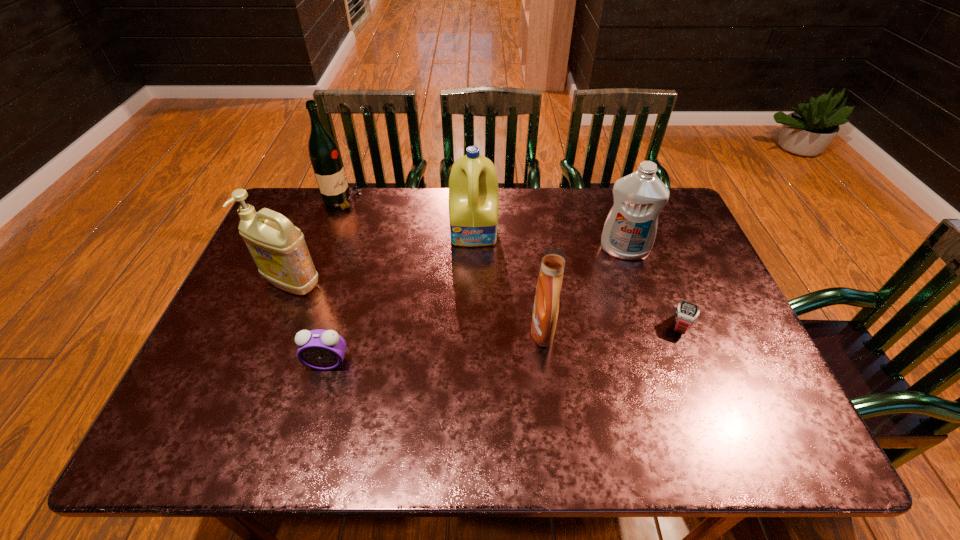
At what (x,y) coordinates should I click in order to perform the action: click on vacant space at the far left corner of the desktop. Please return your answer as a coordinate pair (x, y). Looking at the image, I should click on (309, 209).

In the image, there is a desktop. Where is `vacant region at the far right corner`? vacant region at the far right corner is located at coordinates (676, 217).

This screenshot has height=540, width=960. Find the location of `empty space between the nearest detergent and the sixth tallest object`. empty space between the nearest detergent and the sixth tallest object is located at coordinates (435, 347).

At what (x,y) coordinates should I click in order to perform the action: click on vacant space that's between the third object from right to left and the farthest object. Please return your answer as a coordinate pair (x, y). Looking at the image, I should click on (443, 266).

Locate an element on the screen. vacant area that lies between the shortest object and the alarm clock is located at coordinates (504, 344).

The image size is (960, 540). In order to click on vacant area between the third detergent from right to left and the rightmost detergent in this screenshot , I will do `click(549, 241)`.

Locate an element on the screen. vacant region between the fourth object from right to left and the nearest object is located at coordinates (401, 298).

You are a GUI agent. You are given a task and a screenshot of the screen. Output one action in this format:
    pyautogui.click(x=<x>, y=<y>)
    Task: Click on the free space between the wine bottle and the nearest object
    
    Given the screenshot: What is the action you would take?
    pyautogui.click(x=335, y=282)

Locate an element on the screen. This screenshot has width=960, height=540. free space between the nearest object and the second nearest detergent is located at coordinates (310, 323).

The width and height of the screenshot is (960, 540). I want to click on empty space between the third detergent from right to left and the nearest object, so click(x=401, y=298).